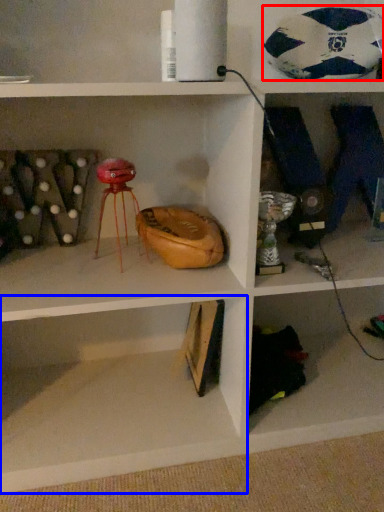
Question: Which object appears farthest to the camera in this image, football (highlighted by a red box) or shelf (highlighted by a blue box)?

Choices:
 (A) football
 (B) shelf

Answer: (A)